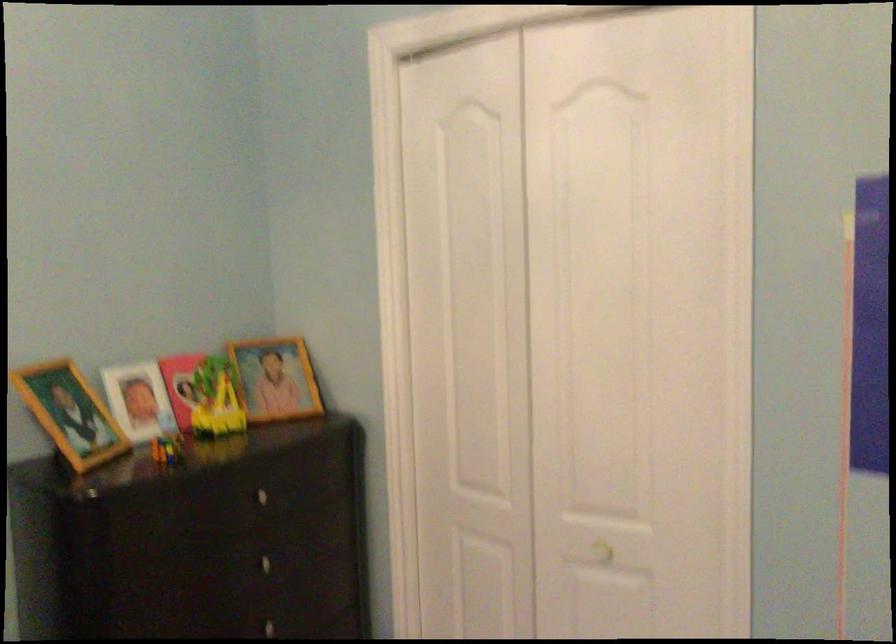
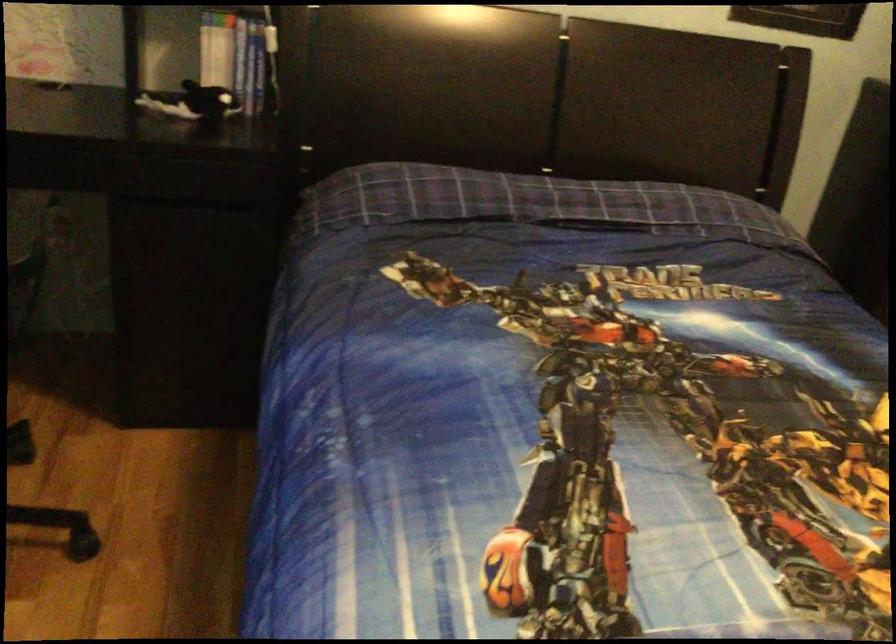
The first image is from the beginning of the video and the second image is from the end. How did the camera likely rotate when shooting the video?

The camera's rotation is toward left-down.